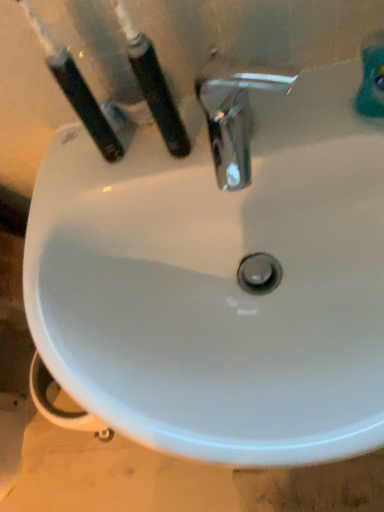
Question: From the image's perspective, is black plastic toothbrush at upper left, the 1th toothbrush viewed from the right, positioned above or below black plastic toothbrush at upper left, positioned as the second toothbrush in right-to-left order?

Choices:
 (A) below
 (B) above

Answer: (A)

Question: Does point (157, 92) appear closer or farther from the camera than point (74, 101)?

Choices:
 (A) farther
 (B) closer

Answer: (B)

Question: From a real-world perspective, is black plastic toothbrush at upper left, the second toothbrush viewed from the left, physically located above or below black plastic toothbrush at upper left, acting as the 1th toothbrush starting from the left?

Choices:
 (A) above
 (B) below

Answer: (B)

Question: Relative to black plastic toothbrush at upper left, the 1th toothbrush viewed from the right, is black plastic toothbrush at upper left, acting as the 1th toothbrush starting from the left, in front or behind?

Choices:
 (A) front
 (B) behind

Answer: (B)

Question: Is black plastic toothbrush at upper left, acting as the 1th toothbrush starting from the left, to the left or to the right of black plastic toothbrush at upper left, the second toothbrush viewed from the left, in the image?

Choices:
 (A) left
 (B) right

Answer: (A)

Question: Is point (62, 69) positioned closer to the camera than point (173, 137)?

Choices:
 (A) closer
 (B) farther

Answer: (A)

Question: From a real-world perspective, is black plastic toothbrush at upper left, positioned as the second toothbrush in right-to-left order, above or below black plastic toothbrush at upper left, the 1th toothbrush viewed from the right?

Choices:
 (A) above
 (B) below

Answer: (A)